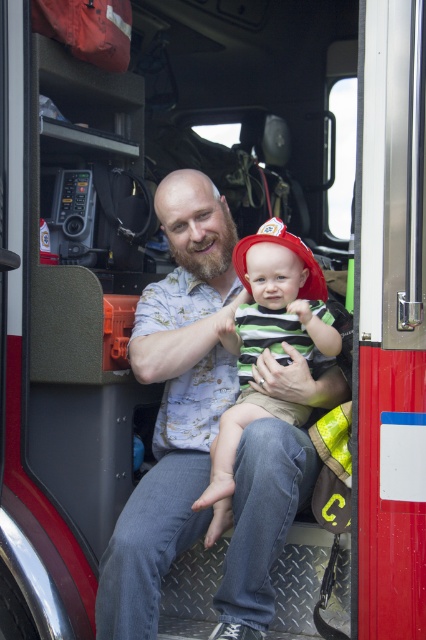
Question: Which point appears closest to the camera in this image?

Choices:
 (A) [x=282, y=301]
 (B) [x=207, y=436]

Answer: (A)

Question: Does matte blue shirt at center appear on the right side of striped cotton shirt at center?

Choices:
 (A) yes
 (B) no

Answer: (B)

Question: Is matte blue shirt at center below striped cotton shirt at center?

Choices:
 (A) yes
 (B) no

Answer: (B)

Question: Which object appears farthest from the camera in this image?

Choices:
 (A) matte blue shirt at center
 (B) striped cotton shirt at center

Answer: (B)

Question: Is matte blue shirt at center closer to the viewer compared to striped cotton shirt at center?

Choices:
 (A) no
 (B) yes

Answer: (B)